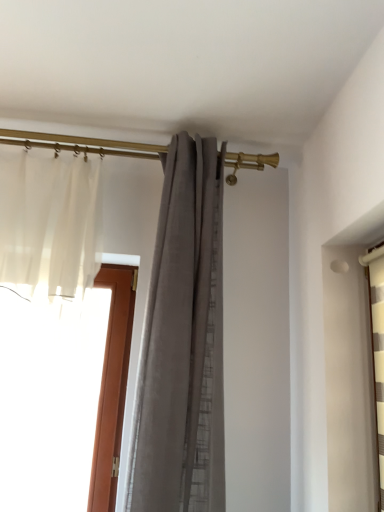
Identify the location of velvet gray curtain at center. The width and height of the screenshot is (384, 512). (183, 343).

In order to face velvet gray curtain at center, should I rotate leftwards or rightwards?

To face it directly, rotate left by 0.700 degrees.

What is the approximate width of velvet gray curtain at center?

velvet gray curtain at center is 17.61 inches in width.

The height and width of the screenshot is (512, 384). Describe the element at coordinates (183, 343) in the screenshot. I see `velvet gray curtain at center` at that location.

The height and width of the screenshot is (512, 384). I want to click on velvet gray curtain at center, so click(x=183, y=343).